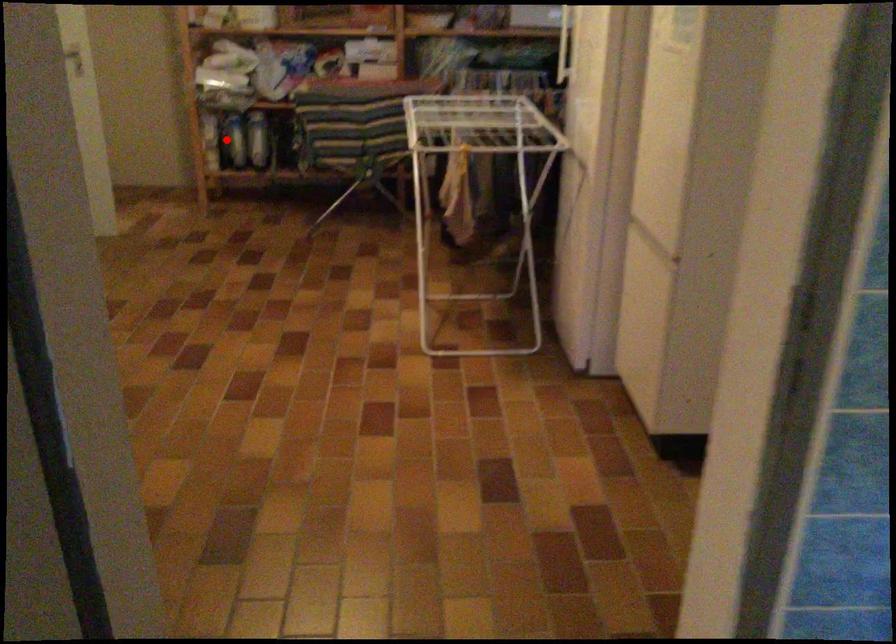
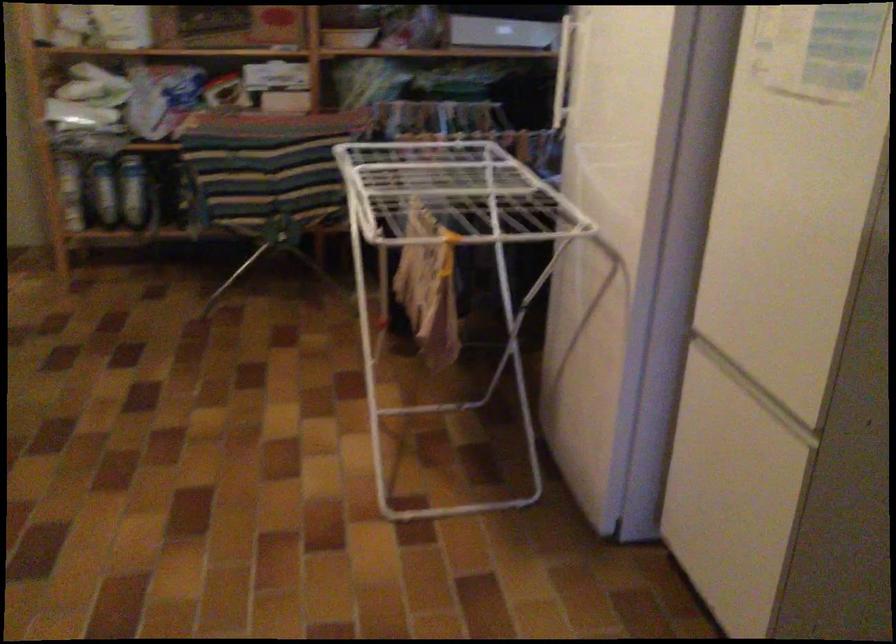
Locate, in the second image, the point that corresponds to the highlighted location in the first image.

(101, 191)